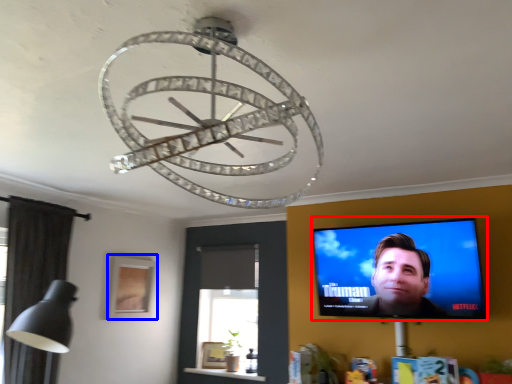
Question: Which point is closer to the camera, computer screen (highlighted by a red box) or picture frame (highlighted by a blue box)?

Choices:
 (A) computer screen
 (B) picture frame

Answer: (A)